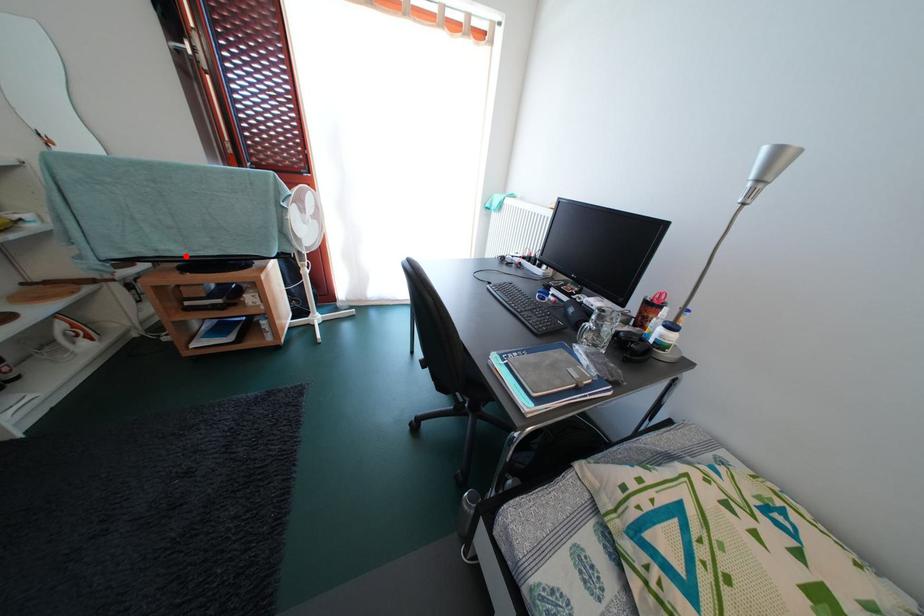
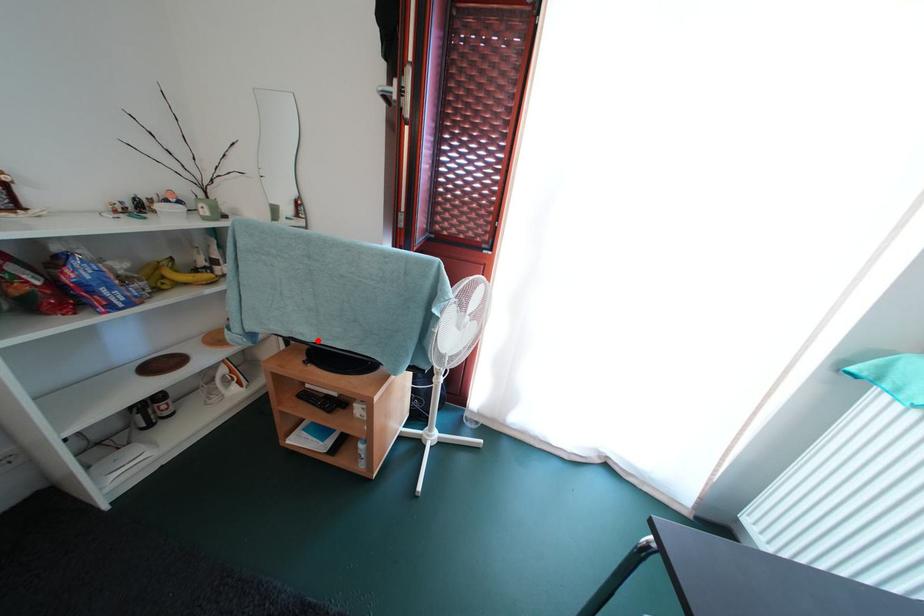
I am providing you with two images of the same scene from different viewpoints. A red point is marked on the first image and another point is marked on the second image. Are the points marked in image1 and image2 representing the same 3D position?

Yes